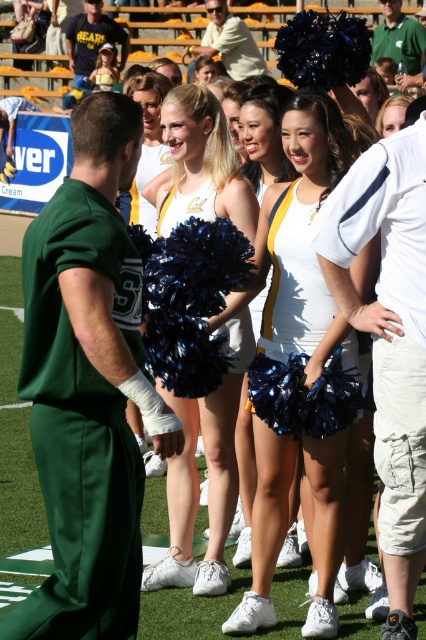
Which is more to the right, white matte cheerleader uniform at center or shiny blue pom-poms at center?

Positioned to the right is white matte cheerleader uniform at center.

Between point (275, 388) and point (247, 330), which one is positioned behind?

Point (247, 330)

Identify the location of white matte cheerleader uniform at center. (299, 336).

This screenshot has width=426, height=640. I want to click on white matte cheerleader uniform at center, so click(x=299, y=336).

Who is more forward, (x=345, y=285) or (x=241, y=316)?

Point (x=345, y=285) is more forward.

This screenshot has width=426, height=640. In order to click on white cotton cheerleader pom-poms at center in this screenshot , I will do `click(388, 314)`.

At what (x,y) coordinates should I click in order to perform the action: click on white cotton cheerleader pom-poms at center. Please return your answer as a coordinate pair (x, y). Looking at the image, I should click on (388, 314).

Who is more distant from viewer, (62, 269) or (402, 433)?

The point (402, 433) is behind.

Does green fabric pants at left have a smaller size compared to white cotton cheerleader pom-poms at center?

Incorrect, green fabric pants at left is not smaller in size than white cotton cheerleader pom-poms at center.

Measure the distance between point (80, 592) and camera.

Point (80, 592) is 4.47 meters from camera.

The image size is (426, 640). Find the location of `green fabric pants at left`. green fabric pants at left is located at coordinates point(80,428).